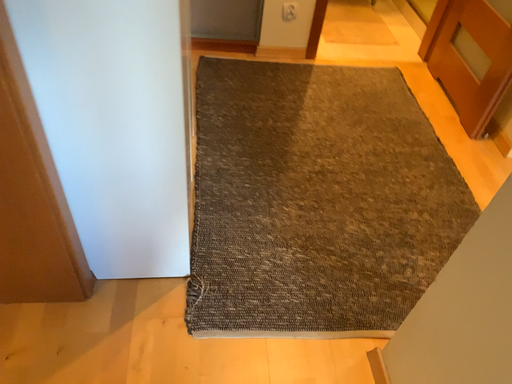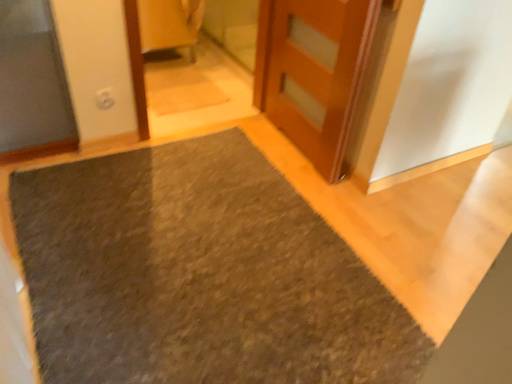
Question: Which way did the camera rotate in the video?

Choices:
 (A) rotated right
 (B) rotated left

Answer: (A)